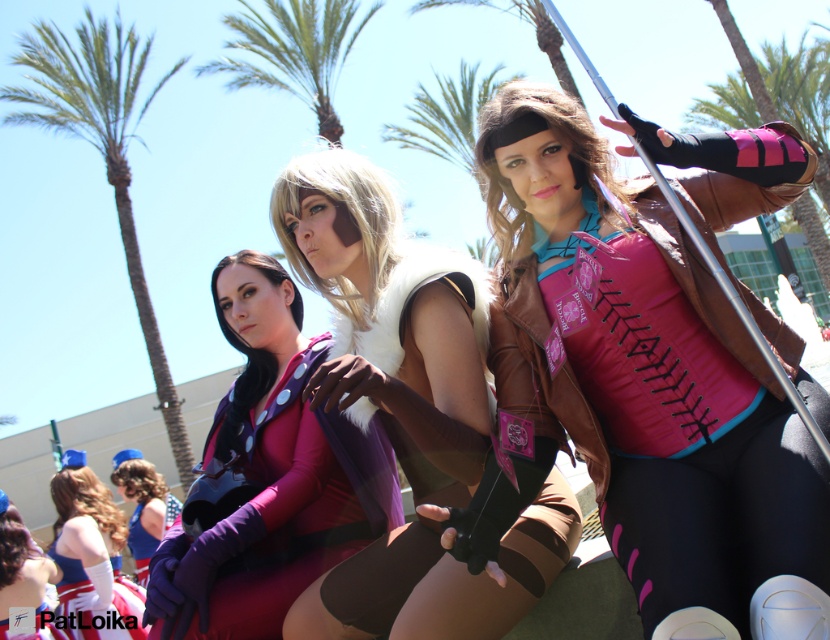
Question: Is matte purple bodysuit at center to the right of shiny blue fabric dress at lower left from the viewer's perspective?

Choices:
 (A) no
 (B) yes

Answer: (B)

Question: Which object is farther from the camera taking this photo?

Choices:
 (A) fur-lined leather jacket at center
 (B) green leafy palm tree at upper right
 (C) matte purple dress at lower left
 (D) green leafy palm tree at center

Answer: (B)

Question: Which point is closer to the camera?

Choices:
 (A) matte purple dress at lower left
 (B) green leafy palm tree at upper center
 (C) pink fabric corset at center
 (D) shiny blue fabric dress at lower left

Answer: (C)

Question: Which object appears farthest from the camera in this image?

Choices:
 (A) green leafy palm tree at upper left
 (B) green leafy palm tree at upper right
 (C) fur-lined leather jacket at center

Answer: (B)

Question: From the image, what is the correct spatial relationship of green leafy palm tree at upper center in relation to matte purple dress at lower left?

Choices:
 (A) left
 (B) right

Answer: (A)

Question: Can you confirm if green leafy palm tree at upper left is wider than matte purple dress at lower left?

Choices:
 (A) yes
 (B) no

Answer: (A)